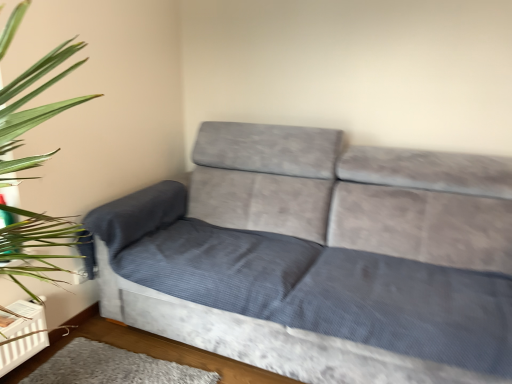
Question: From a real-world perspective, is velvet gray couch at center positioned above or below gray soft rug at lower center?

Choices:
 (A) below
 (B) above

Answer: (B)

Question: In the image, is velvet gray couch at center positioned in front of or behind gray soft rug at lower center?

Choices:
 (A) front
 (B) behind

Answer: (A)

Question: From the image's perspective, is velvet gray couch at center located above or below gray soft rug at lower center?

Choices:
 (A) above
 (B) below

Answer: (A)

Question: Is gray soft rug at lower center bigger or smaller than velvet gray couch at center?

Choices:
 (A) big
 (B) small

Answer: (B)

Question: From a real-world perspective, is gray soft rug at lower center above or below velvet gray couch at center?

Choices:
 (A) above
 (B) below

Answer: (B)

Question: Is gray soft rug at lower center inside the boundaries of velvet gray couch at center, or outside?

Choices:
 (A) outside
 (B) inside

Answer: (A)

Question: Is point (67, 344) positioned closer to the camera than point (506, 167)?

Choices:
 (A) closer
 (B) farther

Answer: (B)